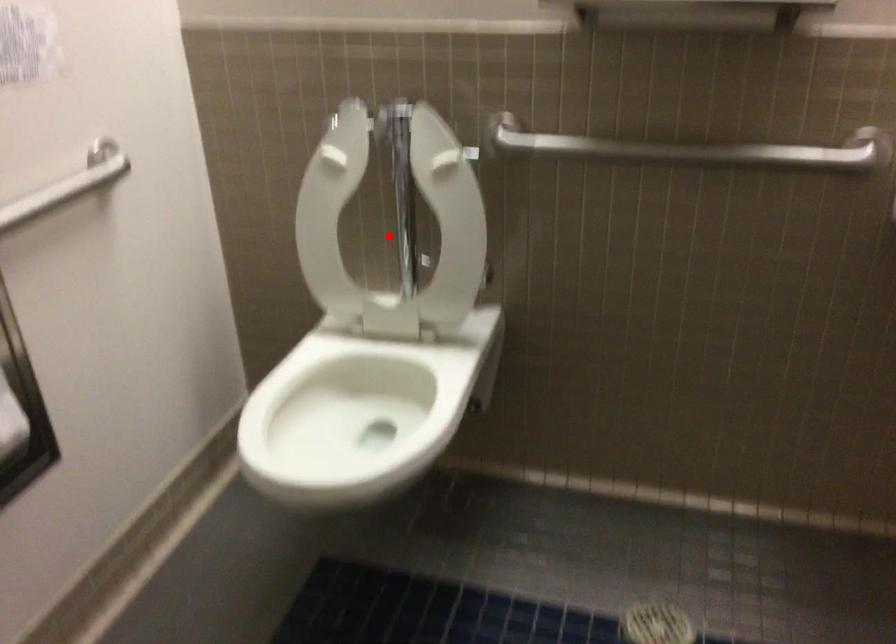
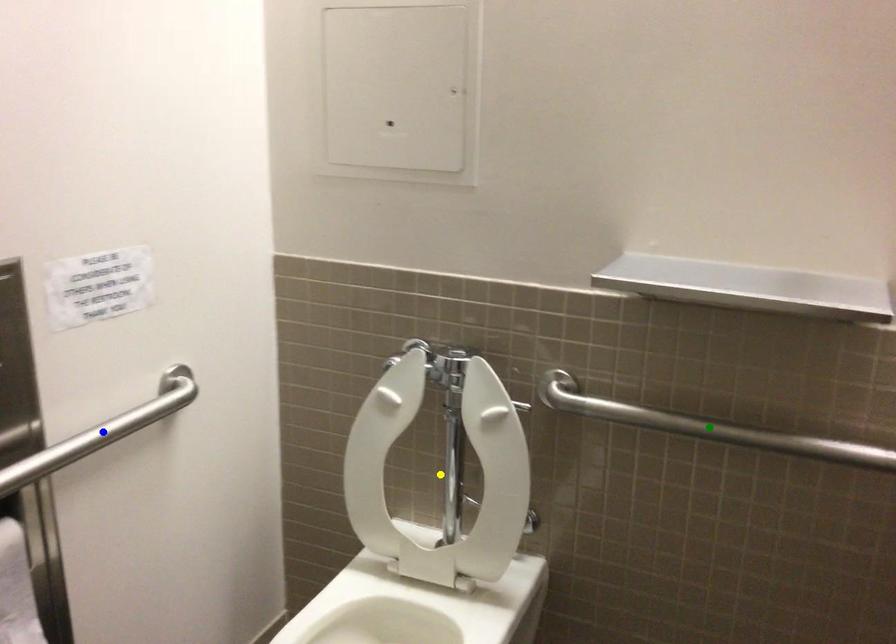
Question: I am providing you with two images of the same scene from different viewpoints. A red point is marked on the first image. You are given multiple points on the second image. Which point in image 2 represents the same 3d spot as the red point in image 1?

Choices:
 (A) blue point
 (B) yellow point
 (C) green point

Answer: (B)